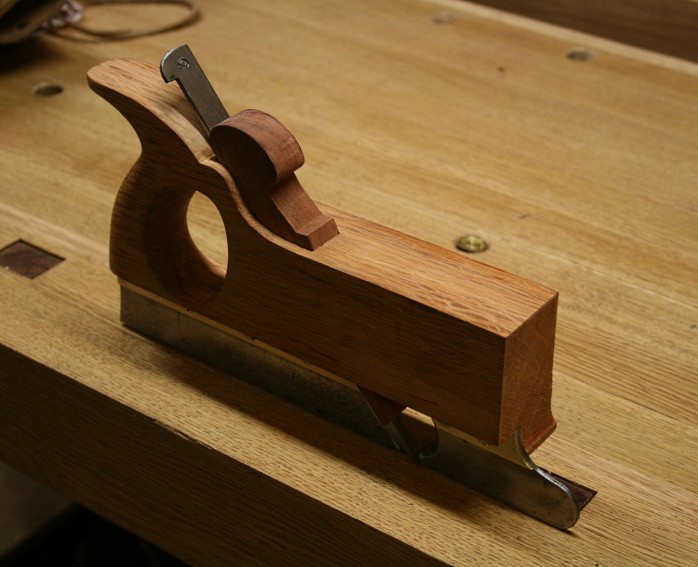
Locate an element on the screen. The height and width of the screenshot is (567, 698). cord is located at coordinates (174, 22).